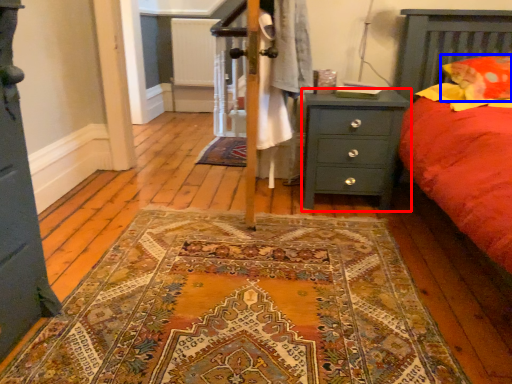
Question: Which object is closer to the camera taking this photo, nightstand (highlighted by a red box) or pillow (highlighted by a blue box)?

Choices:
 (A) nightstand
 (B) pillow

Answer: (B)